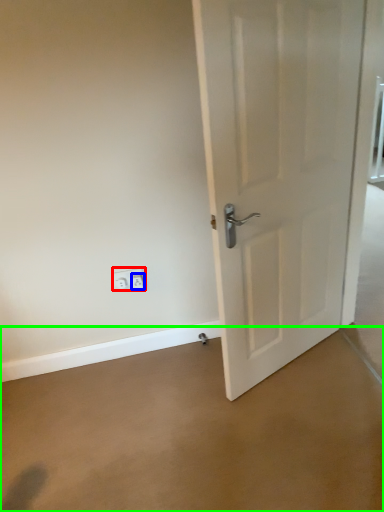
Question: Considering the real-world distances, which object is farthest from electric outlet (highlighted by a red box)? electric outlet (highlighted by a blue box) or concrete (highlighted by a green box)?

Choices:
 (A) electric outlet
 (B) concrete

Answer: (B)